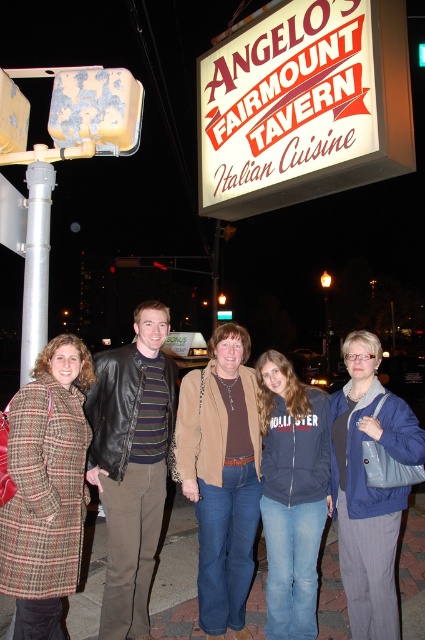
You are a photographer trying to capture the group in front of the tavern sign. You notice the plaid wool coat at lower left and the blue fabric jacket at lower right. Which of these two items is positioned higher in the image?

The plaid wool coat at lower left is positioned higher in the image than the blue fabric jacket at lower right.

You are a photographer trying to capture a group photo of the plaid wool coat at lower left and the blue fabric jacket at lower right. Which coat should you focus on first if you want to include both in the frame without moving the camera?

The plaid wool coat at lower left is to the left of blue fabric jacket at lower right, so you should focus on the plaid wool coat at lower left first to ensure both are in frame without moving the camera.